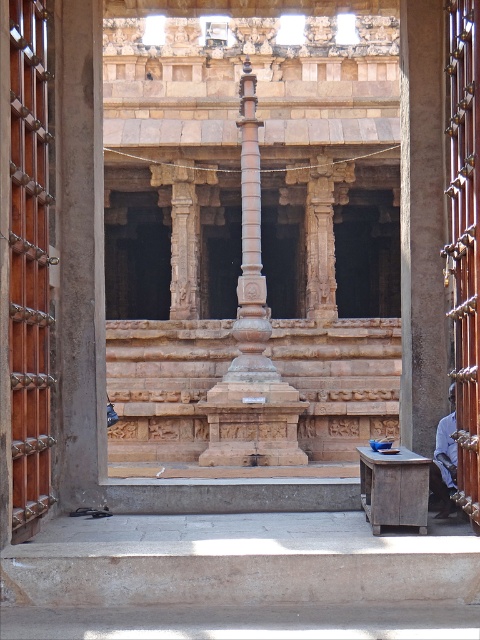
You are an architect visiting the temple and need to determine the spatial relationship between the polished stone pillar at center and the blue fabric shirt at right. Which object is positioned higher in elevation?

The polished stone pillar at center is located above the blue fabric shirt at right, so it is positioned higher in elevation.

Looking at this image, you are standing inside the temple and want to touch both the polished stone pillar at center and the blue fabric shirt at right. Which object should you reach for first, the one closer to you?

The polished stone pillar at center is closer to you than the blue fabric shirt at right, so you should reach for the polished stone pillar at center first.

You are standing in the temple and want to know how far the point marked at coordinates point (253, 269) is from you. Can you determine the distance?

The point marked at coordinates point (253, 269) is 55.57 meters away from you.